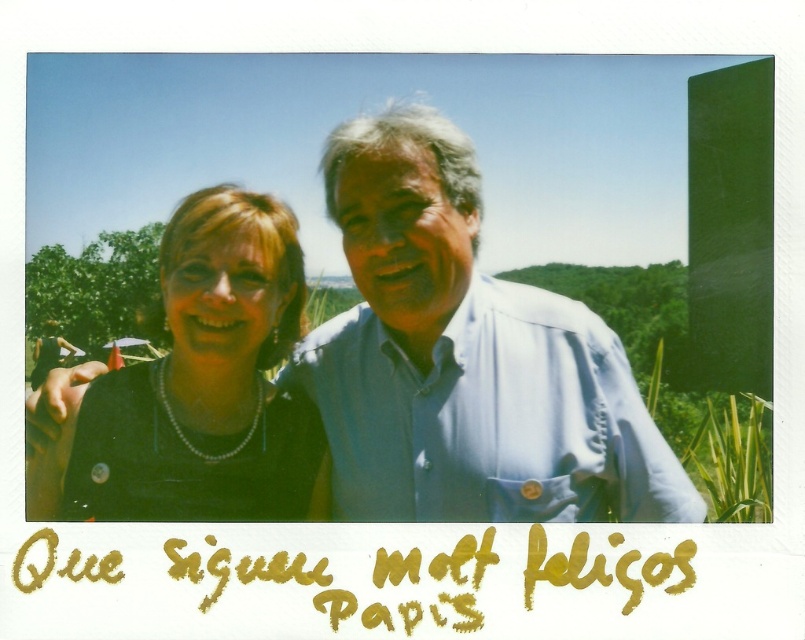
You are a photographer trying to capture a closeup of the pearl necklace at center without including the black matte shirt at center in the frame. Given their positions, is this possible?

The pearl necklace at center is above the black matte shirt at center, so if you position the camera to focus on the upper part of the subject where the necklace is located, you can exclude the black matte shirt at center which is positioned lower down.

You are taking a photo of the two people in the park. You want to focus on the person closer to the camera. Which point should you focus on, point (613, 424) or point (234, 472)?

Point (613, 424) is closer to the camera than point (234, 472), so you should focus on point (613, 424).

You are a photographer trying to capture a closeup of the black matte shirt at center and the pearl necklace at center. Which one should you zoom in on more to ensure both are in focus?

The black matte shirt at center is wider than pearl necklace at center, so you should zoom in more on the pearl necklace at center to ensure both are in focus.